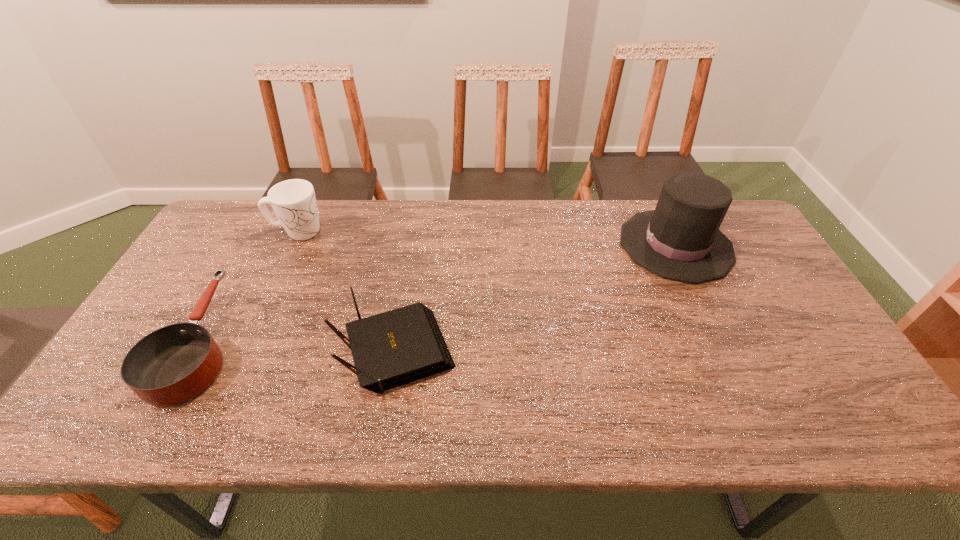
Locate an element on the screen. The image size is (960, 540). free location located on the left of the third tallest object is located at coordinates coord(266,355).

The image size is (960, 540). What are the coordinates of `free space located 0.130m on the handle side of the pan` in the screenshot? It's located at (248, 255).

The image size is (960, 540). I want to click on vacant region located on the handle side of the pan, so click(x=269, y=218).

You are a GUI agent. You are given a task and a screenshot of the screen. Output one action in this format:
    pyautogui.click(x=<x>, y=<y>)
    Task: Click on the blank space located 0.060m on the handle side of the pan
    This screenshot has height=540, width=960.
    Given the screenshot: What is the action you would take?
    pyautogui.click(x=239, y=271)

You are a GUI agent. You are given a task and a screenshot of the screen. Output one action in this format:
    pyautogui.click(x=<x>, y=<y>)
    Task: Click on the dress hat at the far edge
    
    Given the screenshot: What is the action you would take?
    pyautogui.click(x=680, y=240)

Find the location of a particular element. The height and width of the screenshot is (540, 960). mug that is at the far edge is located at coordinates (294, 202).

Locate an element on the screen. This screenshot has height=540, width=960. router located at the near edge is located at coordinates (x=397, y=347).

This screenshot has height=540, width=960. I want to click on pan that is at the near edge, so point(171,365).

I want to click on object that is at the left edge, so click(171, 365).

You are a GUI agent. You are given a task and a screenshot of the screen. Output one action in this format:
    pyautogui.click(x=<x>, y=<y>)
    Task: Click on the object at the right edge
    
    Given the screenshot: What is the action you would take?
    pyautogui.click(x=680, y=240)